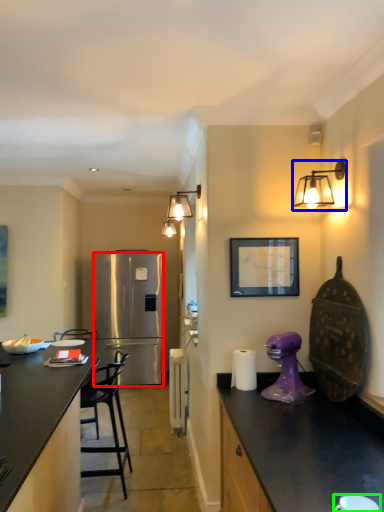
Question: Based on their relative distances, which object is nearer to refrigerator (highlighted by a red box)? Choose from light fixture (highlighted by a blue box) and coffee cup (highlighted by a green box).

Choices:
 (A) light fixture
 (B) coffee cup

Answer: (A)